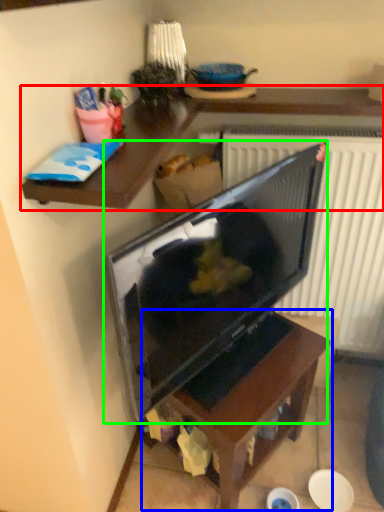
Question: Considering the real-world distances, which object is closest to desk (highlighted by a red box)? table (highlighted by a blue box) or television (highlighted by a green box).

Choices:
 (A) table
 (B) television

Answer: (B)